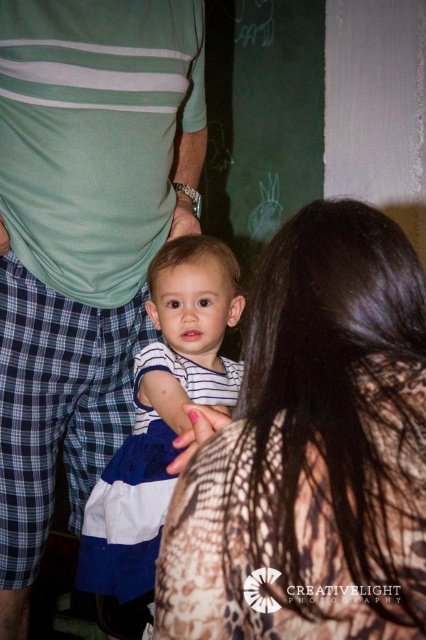
You are standing in the room and see the green striped shirt at center and the white striped shirt at center. Which one is positioned to the left?

The green striped shirt at center is to the left of the white striped shirt at center.

You are a photographer trying to focus on the white striped shirt at center and the pink matte nail polish at center. Which object should you zoom in on to get a clearer image of its details?

The pink matte nail polish at center is smaller than the white striped shirt at center, so zooming in on the pink matte nail polish at center would allow you to capture its details more clearly.

You are a photographer trying to capture a closeup of the white striped shirt at center. You notice the matte skin hand at center might be blocking your shot. Based on the scene, can you determine if the hand is above or below the shirt?

The white striped shirt at center is below the matte skin hand at center, so the hand is above the shirt and could block the shot.